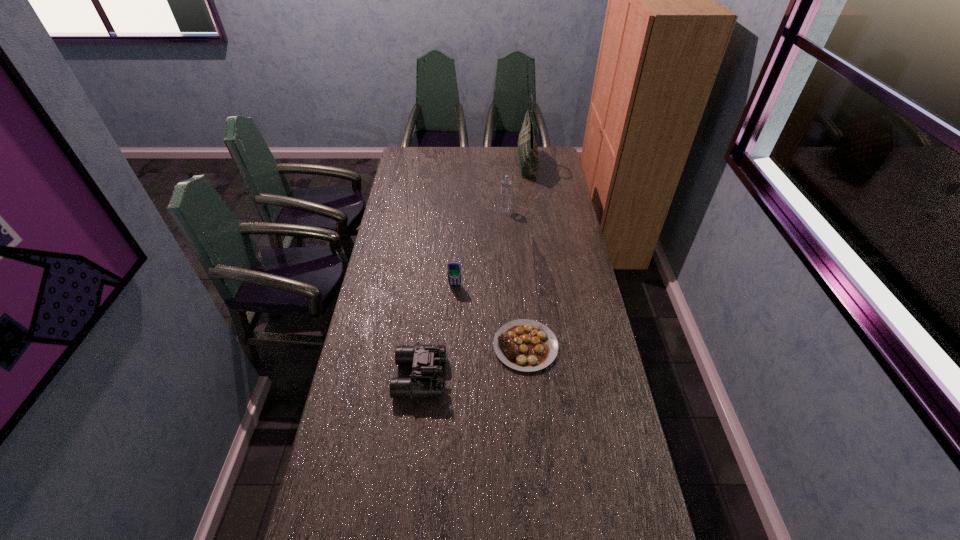
You are a GUI agent. You are given a task and a screenshot of the screen. Output one action in this format:
    pyautogui.click(x=<x>, y=<y>)
    Task: Click on the free space at the far left corner of the desktop
    The width and height of the screenshot is (960, 540).
    Given the screenshot: What is the action you would take?
    pyautogui.click(x=422, y=151)

Locate an element on the screen. This screenshot has width=960, height=540. vacant area that lies between the binoculars and the second tallest object is located at coordinates (463, 294).

The image size is (960, 540). What are the coordinates of `empty space between the binoculars and the third nearest object` in the screenshot? It's located at (438, 331).

The image size is (960, 540). What are the coordinates of `empty location between the farthest object and the second farthest object` in the screenshot? It's located at (516, 187).

Where is `free space between the steak and the tallest object`? The image size is (960, 540). free space between the steak and the tallest object is located at coordinates (526, 255).

Find the location of a particular element. The height and width of the screenshot is (540, 960). free spot between the farthest object and the fourth nearest object is located at coordinates (516, 187).

Find the location of a particular element. Image resolution: width=960 pixels, height=540 pixels. empty space between the binoculars and the second tallest object is located at coordinates (463, 294).

This screenshot has height=540, width=960. In order to click on unoccupied area between the farthest object and the third farthest object in this screenshot , I will do `click(492, 225)`.

Locate an element on the screen. Image resolution: width=960 pixels, height=540 pixels. object that stands as the fourth closest to the shortest object is located at coordinates (527, 148).

Find the location of `object identified as the fourth closest to the second farthest object`. object identified as the fourth closest to the second farthest object is located at coordinates (426, 359).